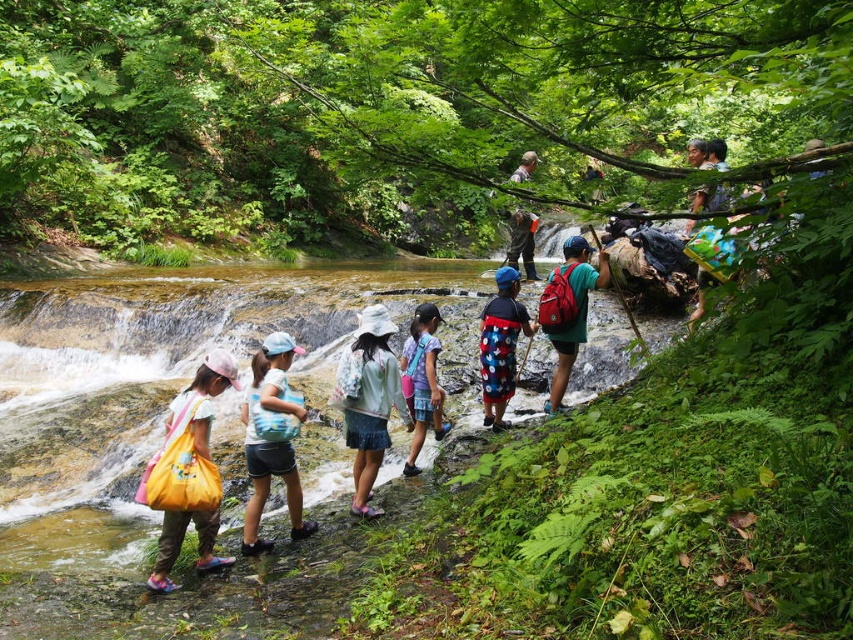
You are standing at the camera position and want to reach point [300,298]. Is the distance more than 50 feet?

Yes, the distance between the camera and point [300,298] is 51.63 feet, which is more than 50 feet.

You are a photographer trying to capture the group in the stream scene. You notice the floral fabric hat at center and the pastel blue fabric backpack at center. Which object is positioned lower in the image?

The floral fabric hat at center is located below the pastel blue fabric backpack at center, so it is positioned lower in the image.